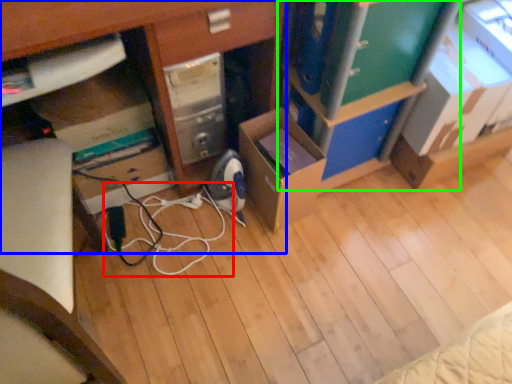
Question: Considering the real-world distances, which object is closest to cable (highlighted by a red box)? desk (highlighted by a blue box) or bookshelf (highlighted by a green box).

Choices:
 (A) desk
 (B) bookshelf

Answer: (A)